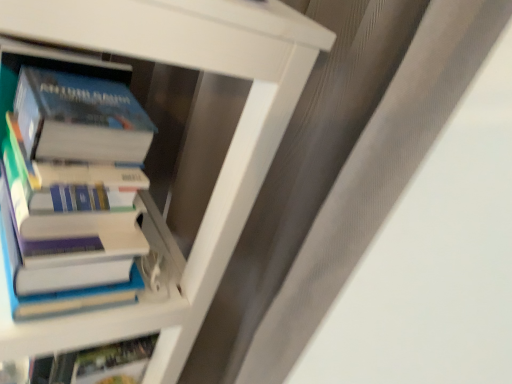
Question: Should I look upward or downward to see hardcover books at left, which is the 1th book in top-to-bottom order?

Choices:
 (A) down
 (B) up

Answer: (B)

Question: Would you say hardcover books at left, which is the 1th book in top-to-bottom order, is part of hardcover book at left, acting as the 2th book starting from the top,'s contents?

Choices:
 (A) yes
 (B) no

Answer: (A)

Question: Is hardcover book at left, acting as the 2th book starting from the top, not inside hardcover books at left, which is the 1th book in top-to-bottom order?

Choices:
 (A) no
 (B) yes

Answer: (B)

Question: From the image's perspective, would you say hardcover book at left, arranged as the 1th book when ordered from the bottom, is positioned over hardcover books at left, the 2th book when ordered from bottom to top?

Choices:
 (A) yes
 (B) no

Answer: (B)

Question: From a real-world perspective, does hardcover book at left, acting as the 2th book starting from the top, stand above hardcover books at left, which is the 1th book in top-to-bottom order?

Choices:
 (A) yes
 (B) no

Answer: (B)

Question: Can you confirm if hardcover book at left, acting as the 2th book starting from the top, is positioned to the right of hardcover books at left, which is the 1th book in top-to-bottom order?

Choices:
 (A) yes
 (B) no

Answer: (B)

Question: Is hardcover book at left, acting as the 2th book starting from the top, shorter than hardcover books at left, which is the 1th book in top-to-bottom order?

Choices:
 (A) no
 (B) yes

Answer: (A)

Question: Considering the relative sizes of hardcover books at left, the 2th book when ordered from bottom to top, and hardcover book at left, arranged as the 1th book when ordered from the bottom, in the image provided, is hardcover books at left, the 2th book when ordered from bottom to top, smaller than hardcover book at left, arranged as the 1th book when ordered from the bottom,?

Choices:
 (A) yes
 (B) no

Answer: (A)

Question: Does hardcover books at left, which is the 1th book in top-to-bottom order, touch hardcover book at left, acting as the 2th book starting from the top?

Choices:
 (A) yes
 (B) no

Answer: (A)

Question: Are hardcover books at left, the 2th book when ordered from bottom to top, and hardcover book at left, arranged as the 1th book when ordered from the bottom, located far from each other?

Choices:
 (A) yes
 (B) no

Answer: (B)

Question: From a real-world perspective, is hardcover books at left, the 2th book when ordered from bottom to top, beneath hardcover book at left, arranged as the 1th book when ordered from the bottom?

Choices:
 (A) yes
 (B) no

Answer: (B)

Question: Is hardcover books at left, the 2th book when ordered from bottom to top, positioned behind hardcover book at left, arranged as the 1th book when ordered from the bottom?

Choices:
 (A) yes
 (B) no

Answer: (A)

Question: Is the position of hardcover books at left, the 2th book when ordered from bottom to top, less distant than that of hardcover book at left, arranged as the 1th book when ordered from the bottom?

Choices:
 (A) yes
 (B) no

Answer: (B)

Question: Is hardcover book at left, arranged as the 1th book when ordered from the bottom, wider or thinner than hardcover books at left, which is the 1th book in top-to-bottom order?

Choices:
 (A) wide
 (B) thin

Answer: (A)